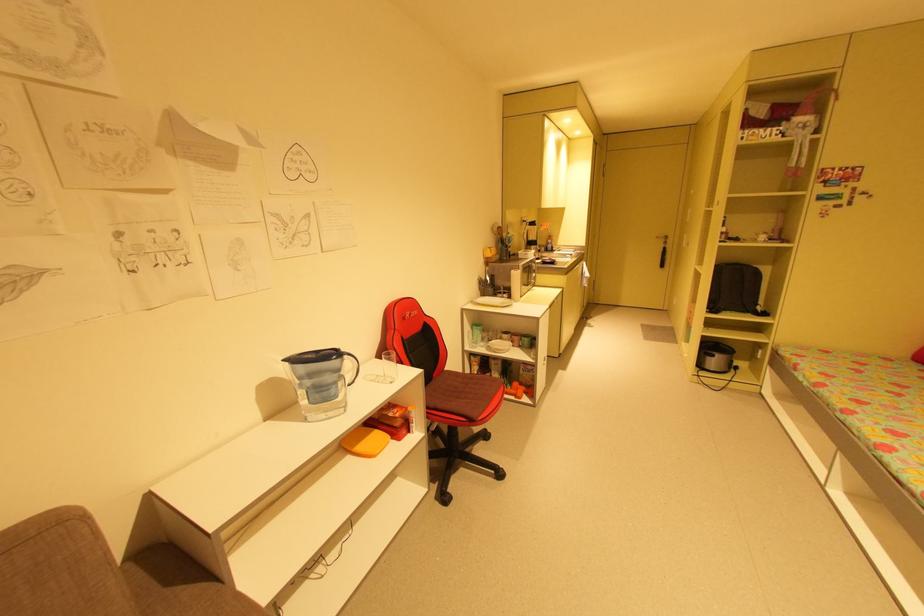
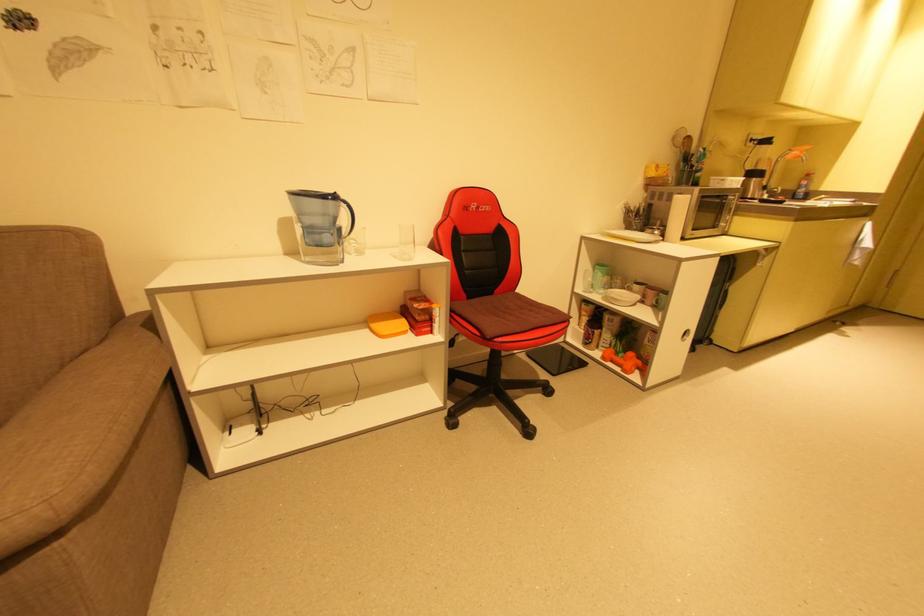
Where in the second image is the point corresponding to (528,395) from the first image?

(641, 371)